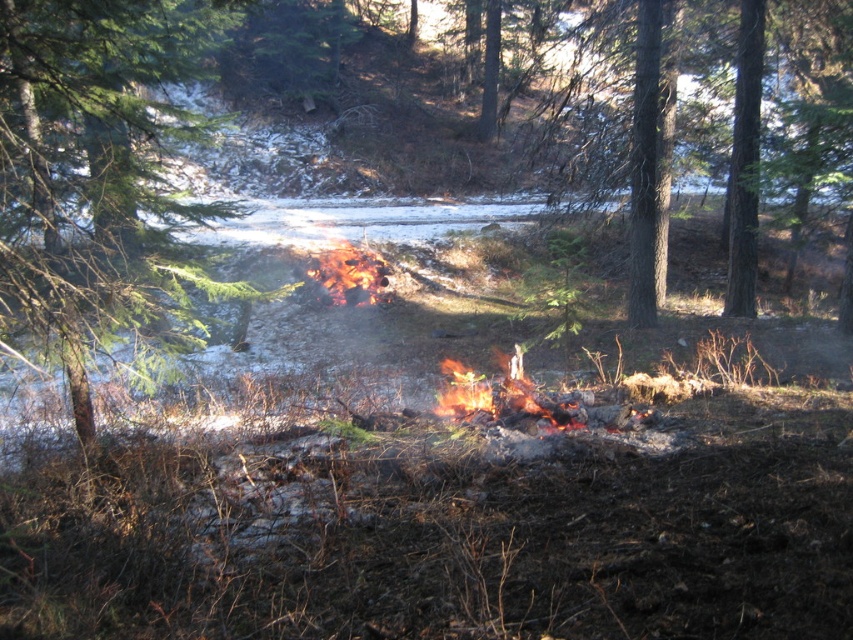
Is charred wood fire at center above flamematerial/texture fire at center?

Incorrect, charred wood fire at center is not positioned above flamematerial/texture fire at center.

Which of these two, charred wood fire at center or flamematerial/texture fire at center, stands shorter?

With less height is charred wood fire at center.

Is point (456, 410) closer to viewer compared to point (376, 276)?

Yes, point (456, 410) is closer to viewer.

Locate an element on the screen. charred wood fire at center is located at coordinates (500, 396).

Does green leafy tree at center have a smaller size compared to charred wood fire at center?

Incorrect, green leafy tree at center is not smaller in size than charred wood fire at center.

Between point (210, 204) and point (442, 413), which one is positioned behind?

Positioned behind is point (210, 204).

What do you see at coordinates (99, 180) in the screenshot? The image size is (853, 640). I see `green leafy tree at center` at bounding box center [99, 180].

Image resolution: width=853 pixels, height=640 pixels. I want to click on green leafy tree at center, so click(99, 180).

Can you confirm if green leafy tree at center is positioned above flamematerial/texture fire at center?

Correct, green leafy tree at center is located above flamematerial/texture fire at center.

Can you confirm if green leafy tree at center is positioned to the left of flamematerial/texture fire at center?

Indeed, green leafy tree at center is positioned on the left side of flamematerial/texture fire at center.

In order to click on green leafy tree at center in this screenshot , I will do `click(99, 180)`.